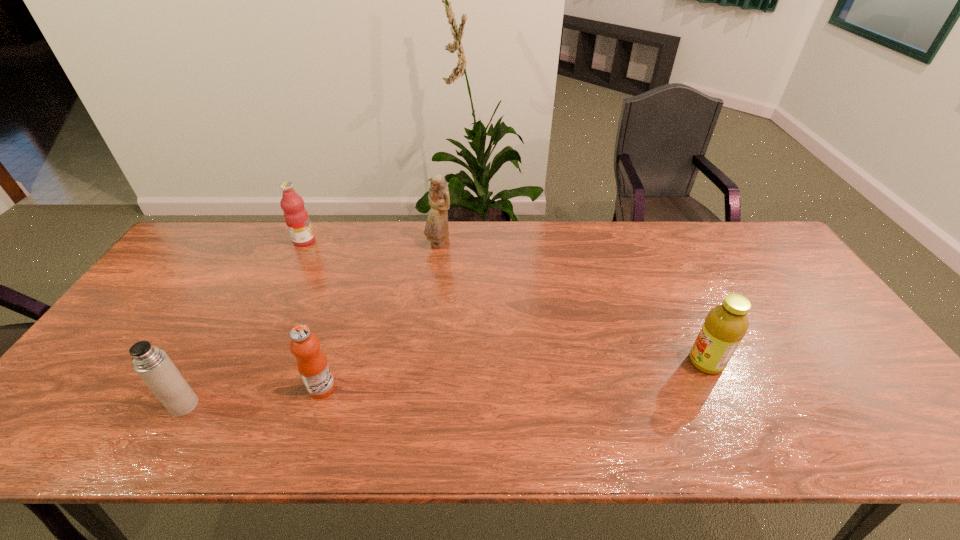
Locate an element on the screen. The width and height of the screenshot is (960, 540). vacant space at the right edge of the desktop is located at coordinates (823, 338).

This screenshot has height=540, width=960. I want to click on free space at the far left corner of the desktop, so click(200, 237).

Where is `vacant space at the near right corner`? The image size is (960, 540). vacant space at the near right corner is located at coordinates (877, 442).

Locate an element on the screen. The height and width of the screenshot is (540, 960). vacant area that lies between the rightmost fruit juice and the fourth object from left to right is located at coordinates (572, 303).

Find the location of a particular element. free space between the leftmost object and the tallest object is located at coordinates (312, 325).

This screenshot has width=960, height=540. Identify the location of vacant space that is in between the second fruit juice from left to right and the tallest object. click(380, 315).

This screenshot has height=540, width=960. Identify the location of free area in between the leftmost object and the leftmost fruit juice. (245, 323).

Where is `free space that is in between the leftmost fruit juice and the rightmost fruit juice`? The width and height of the screenshot is (960, 540). free space that is in between the leftmost fruit juice and the rightmost fruit juice is located at coordinates (505, 301).

You are a GUI agent. You are given a task and a screenshot of the screen. Output one action in this format:
    pyautogui.click(x=<x>, y=<y>)
    Task: Click on the free point between the second object from left to right and the thermos bottle
    This screenshot has height=540, width=960.
    Given the screenshot: What is the action you would take?
    pyautogui.click(x=245, y=323)

You are a GUI agent. You are given a task and a screenshot of the screen. Output one action in this format:
    pyautogui.click(x=<x>, y=<y>)
    Task: Click on the empty location between the third object from right to left and the rightmost object
    This screenshot has height=540, width=960.
    Given the screenshot: What is the action you would take?
    pyautogui.click(x=514, y=375)